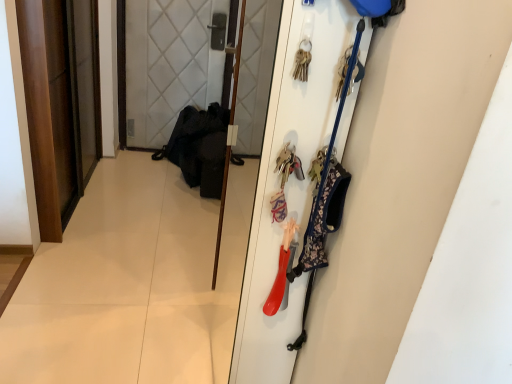
Where is `vacant area that is situated to the right of wooden door at left, the 2th door from the right`? vacant area that is situated to the right of wooden door at left, the 2th door from the right is located at coordinates (150, 215).